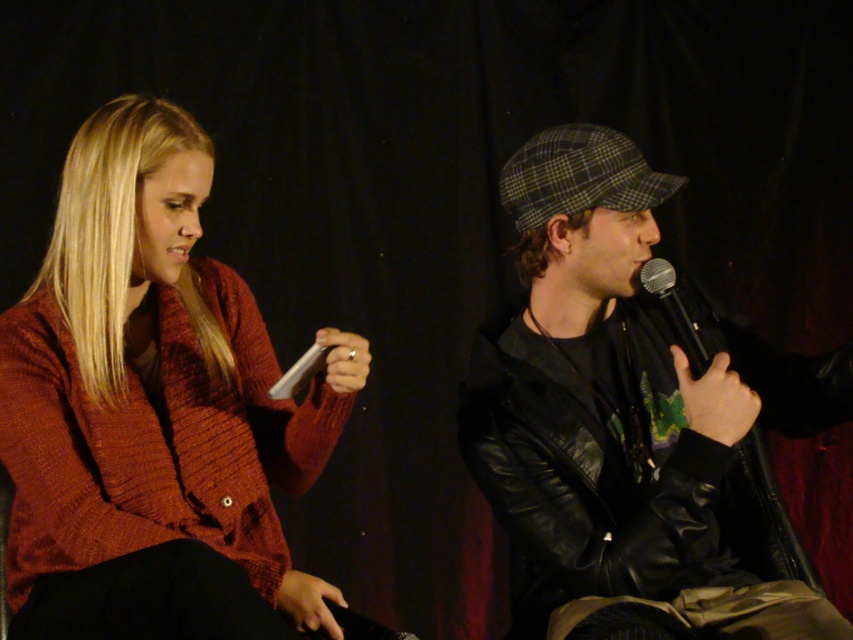
Question: Which point appears farthest from the camera in this image?

Choices:
 (A) [x=704, y=467]
 (B) [x=651, y=257]
 (C) [x=57, y=499]

Answer: (B)

Question: Which of the following is the farthest from the observer?

Choices:
 (A) knitted wool sweater at left
 (B) black metallic microphone at center
 (C) leather jacket at center

Answer: (B)

Question: From the image, what is the correct spatial relationship of knitted wool sweater at left in relation to black metallic microphone at center?

Choices:
 (A) above
 (B) below

Answer: (B)

Question: Can you confirm if knitted wool sweater at left is wider than leather jacket at center?

Choices:
 (A) yes
 (B) no

Answer: (B)

Question: Which of these objects is positioned farthest from the black metallic microphone at center?

Choices:
 (A) knitted wool sweater at left
 (B) leather jacket at center

Answer: (A)

Question: In this image, where is leather jacket at center located relative to black metallic microphone at center?

Choices:
 (A) below
 (B) above

Answer: (A)